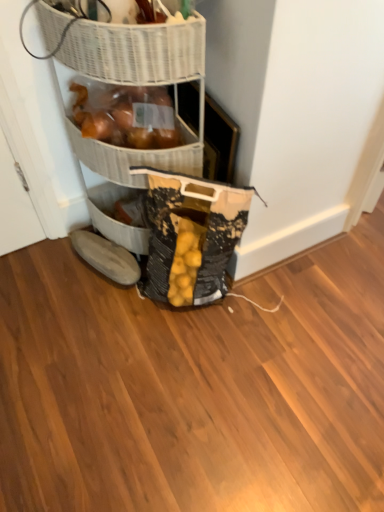
Find the location of `free location to the right of textured canvas bag at lower center`. free location to the right of textured canvas bag at lower center is located at coordinates click(271, 313).